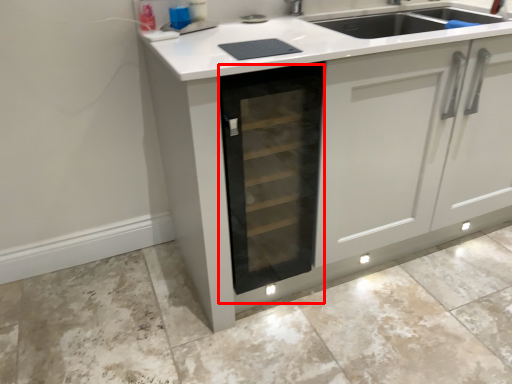
Question: Where is oven (annotated by the red box) located in relation to granite in the image?

Choices:
 (A) right
 (B) left

Answer: (B)